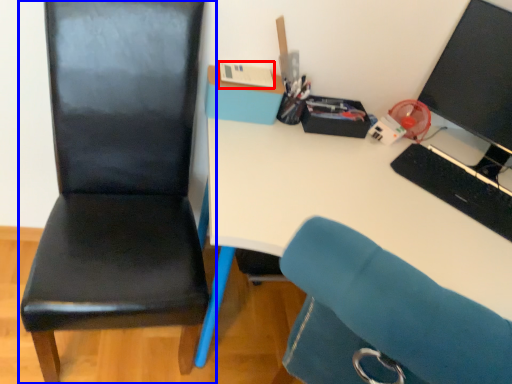
Question: Which of the following is the farthest to the observer, stationery (highlighted by a red box) or chair (highlighted by a blue box)?

Choices:
 (A) stationery
 (B) chair

Answer: (A)